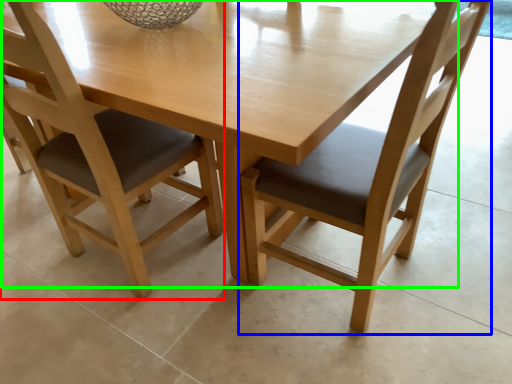
Question: Which object is the closest to the chair (highlighted by a red box)? Choose among these: chair (highlighted by a blue box) or round table (highlighted by a green box).

Choices:
 (A) chair
 (B) round table

Answer: (B)